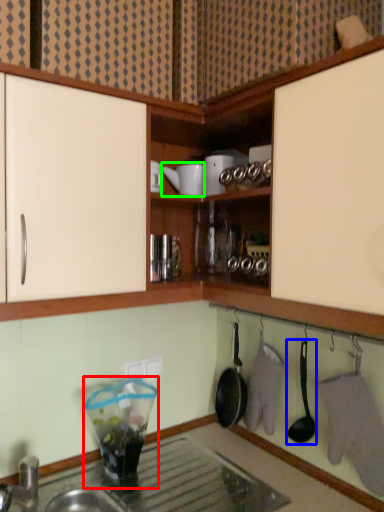
Question: Which object is positioned farthest from appliance (highlighted by a red box)? Select from spoon (highlighted by a blue box) and appliance (highlighted by a green box).

Choices:
 (A) spoon
 (B) appliance

Answer: (B)